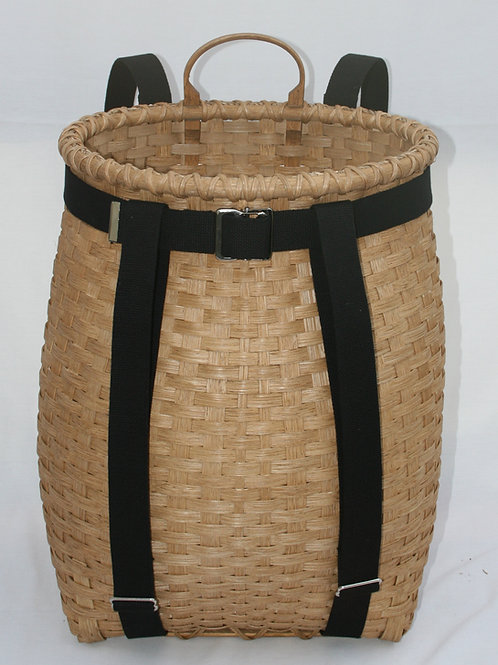
At what (x,y) coordinates should I click in order to perform the action: click on inside of basket. Please return your answer as a coordinate pair (x, y). This screenshot has height=665, width=498. Looking at the image, I should click on pos(244,154).